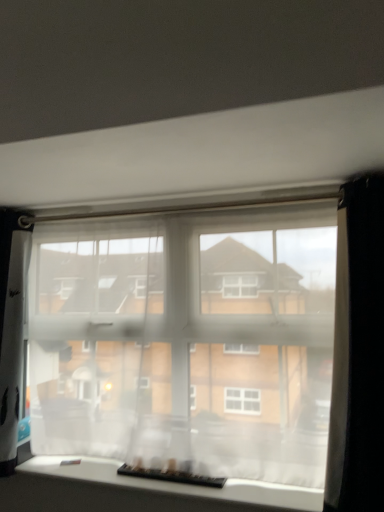
In order to click on free space above translucent fabric at bottom, marked as the 2th window in a top-to-bottom arrangement (from a real-world perspective) in this screenshot , I will do `click(146, 470)`.